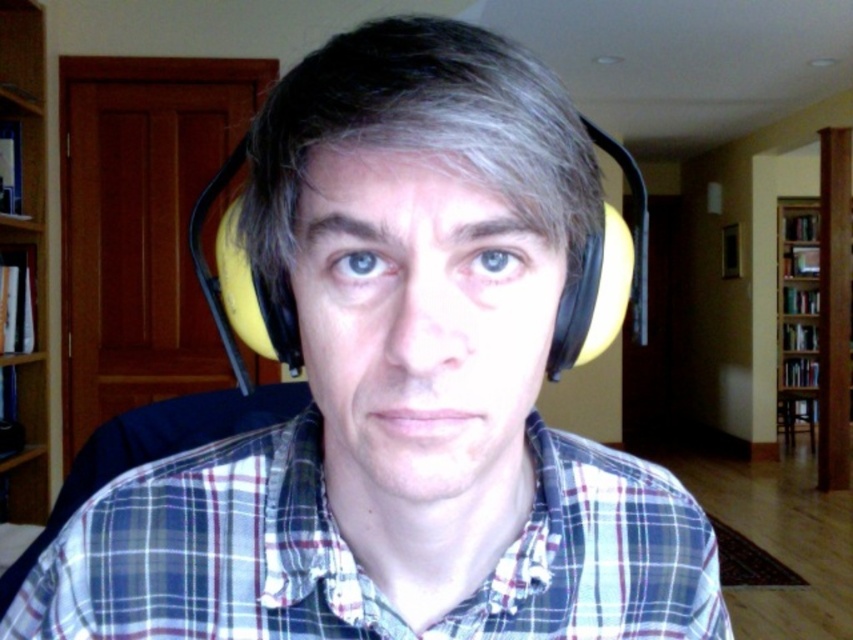
Is yellow foam ear protection at center above light brown wood bookshelf at left?

Actually, yellow foam ear protection at center is below light brown wood bookshelf at left.

Can you confirm if yellow foam ear protection at center is positioned to the right of light brown wood bookshelf at left?

Yes, yellow foam ear protection at center is to the right of light brown wood bookshelf at left.

Does point (494, 163) come closer to viewer compared to point (25, 58)?

Yes, it is in front of point (25, 58).

The height and width of the screenshot is (640, 853). In order to click on yellow foam ear protection at center in this screenshot , I will do `click(422, 131)`.

Who is higher up, yellow foam ear protection at center or wooden bookshelf at right?

yellow foam ear protection at center is higher up.

Is yellow foam ear protection at center to the left of wooden bookshelf at right from the viewer's perspective?

Indeed, yellow foam ear protection at center is positioned on the left side of wooden bookshelf at right.

Is point (352, 72) closer to viewer compared to point (786, 224)?

That is True.

Find the location of a particular element. The width and height of the screenshot is (853, 640). yellow foam ear protection at center is located at coordinates (422, 131).

Can you confirm if light brown wood bookshelf at left is positioned below wooden bookshelf at right?

No.

Is point (1, 10) behind point (809, 388)?

No.

Which is behind, point (26, 374) or point (776, 288)?

The point (776, 288) is behind.

Where is `light brown wood bookshelf at left`? light brown wood bookshelf at left is located at coordinates (27, 248).